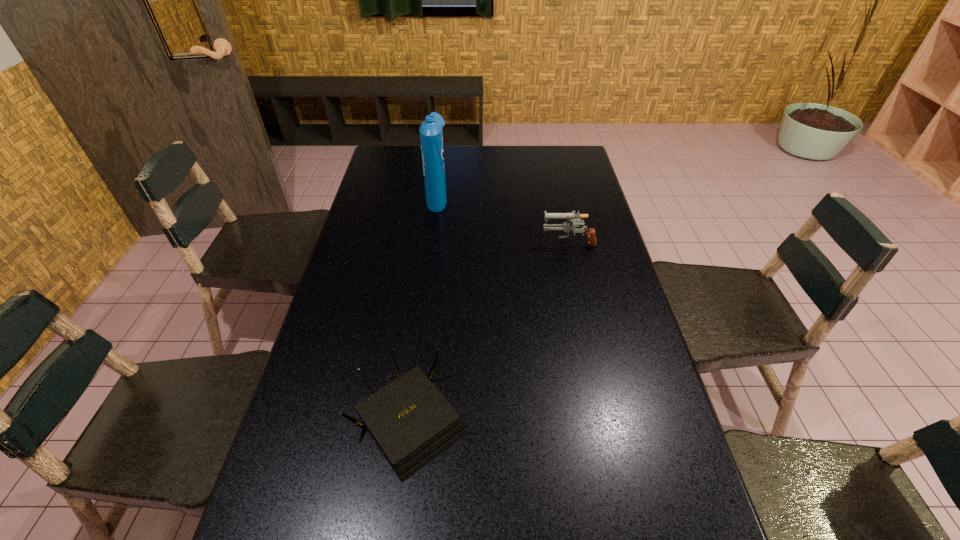
Locate an element on the screen. The height and width of the screenshot is (540, 960). shampoo is located at coordinates (431, 136).

Locate an element on the screen. This screenshot has width=960, height=540. the farthest object is located at coordinates (431, 136).

Find the location of `the rightmost object`. the rightmost object is located at coordinates (566, 226).

The height and width of the screenshot is (540, 960). In order to click on the second shortest object in this screenshot , I will do `click(566, 226)`.

Where is `the nearest object`? This screenshot has height=540, width=960. the nearest object is located at coordinates (411, 422).

Locate an element on the screen. The width and height of the screenshot is (960, 540). router is located at coordinates (411, 422).

This screenshot has width=960, height=540. Find the location of `blank space located on the left of the tallest object`. blank space located on the left of the tallest object is located at coordinates (385, 198).

You are a GUI agent. You are given a task and a screenshot of the screen. Output one action in this format:
    pyautogui.click(x=<x>, y=<y>)
    Task: Click on the free space located 0.250m at the barrel end of the rightmost object
    The width and height of the screenshot is (960, 540).
    Given the screenshot: What is the action you would take?
    pyautogui.click(x=467, y=242)

You are a GUI agent. You are given a task and a screenshot of the screen. Output one action in this format:
    pyautogui.click(x=<x>, y=<y>)
    Task: Click on the free space located 0.170m at the barrel end of the rightmost object
    The width and height of the screenshot is (960, 540).
    Given the screenshot: What is the action you would take?
    pyautogui.click(x=491, y=242)

What are the coordinates of `free location located at the barrel end of the rightmost object` in the screenshot? It's located at pos(484,242).